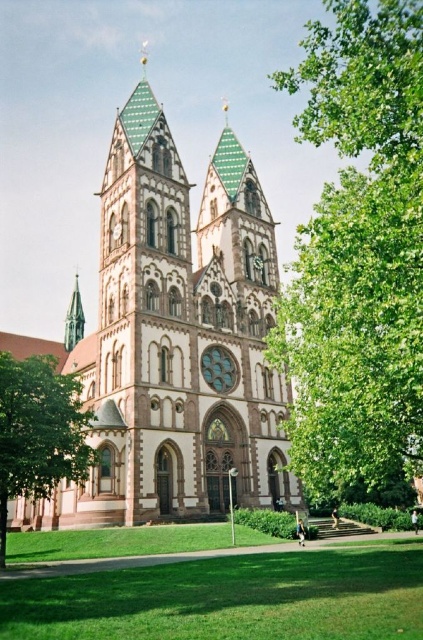
What do you see at coordinates (175, 340) in the screenshot? The width and height of the screenshot is (423, 640). I see `white stone church at center` at bounding box center [175, 340].

Who is more distant from viewer, (258,483) or (68,307)?

The point (68,307) is more distant.

Find the location of a particular element. The width and height of the screenshot is (423, 640). white stone church at center is located at coordinates (175, 340).

What do you see at coordinates (38, 432) in the screenshot? I see `green leafy tree at lower left` at bounding box center [38, 432].

Is green leafy tree at lower left to the left of shiny silver spire at left from the viewer's perspective?

No, green leafy tree at lower left is not to the left of shiny silver spire at left.

At what (x,y) coordinates should I click in order to perform the action: click on green leafy tree at lower left. Please return your answer as a coordinate pair (x, y). Looking at the image, I should click on (38, 432).

What are the coordinates of `green leafy tree at lower left` in the screenshot? It's located at (38, 432).

Is point (359, 236) positioned before point (69, 312)?

Yes, point (359, 236) is in front of point (69, 312).

Is green leafy tree at right bigger than shiny silver spire at left?

Correct, green leafy tree at right is larger in size than shiny silver spire at left.

Find the location of a particular element. This screenshot has width=423, height=640. green leafy tree at right is located at coordinates [359, 253].